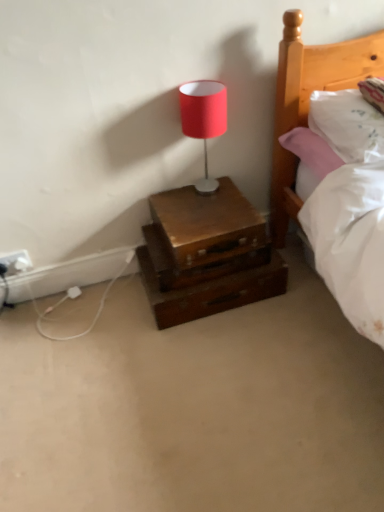
Question: From the image's perspective, is white plastic electric outlet at lower left on white soft mattress at lower right?

Choices:
 (A) no
 (B) yes

Answer: (B)

Question: Does white plastic electric outlet at lower left come in front of white soft mattress at lower right?

Choices:
 (A) yes
 (B) no

Answer: (B)

Question: Is white plastic electric outlet at lower left beside white soft mattress at lower right?

Choices:
 (A) yes
 (B) no

Answer: (B)

Question: Is white plastic electric outlet at lower left to the left of white soft mattress at lower right from the viewer's perspective?

Choices:
 (A) no
 (B) yes

Answer: (B)

Question: Is white plastic electric outlet at lower left facing away from white soft mattress at lower right?

Choices:
 (A) no
 (B) yes

Answer: (A)

Question: Would you say white soft mattress at lower right is part of white plastic electric outlet at lower left's contents?

Choices:
 (A) no
 (B) yes

Answer: (A)

Question: Is white plastic electric outlet at lower left not close to wooden nightstand at center?

Choices:
 (A) yes
 (B) no

Answer: (B)

Question: Considering the relative sizes of white plastic electric outlet at lower left and wooden nightstand at center in the image provided, is white plastic electric outlet at lower left thinner than wooden nightstand at center?

Choices:
 (A) no
 (B) yes

Answer: (B)

Question: Is white plastic electric outlet at lower left facing towards wooden nightstand at center?

Choices:
 (A) no
 (B) yes

Answer: (A)

Question: Considering the relative positions of white plastic electric outlet at lower left and wooden nightstand at center in the image provided, is white plastic electric outlet at lower left behind wooden nightstand at center?

Choices:
 (A) yes
 (B) no

Answer: (A)

Question: Is white plastic electric outlet at lower left at the left side of wooden nightstand at center?

Choices:
 (A) yes
 (B) no

Answer: (A)

Question: Does white plastic electric outlet at lower left have a greater height compared to wooden nightstand at center?

Choices:
 (A) no
 (B) yes

Answer: (A)

Question: Is wooden chest at lower center smaller than white plastic electric outlet at lower left?

Choices:
 (A) no
 (B) yes

Answer: (A)